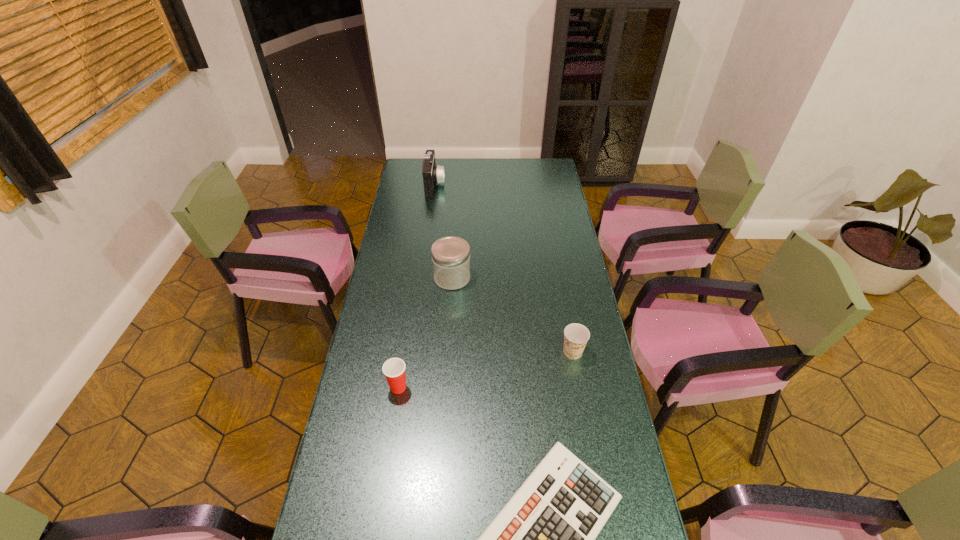
Where is `vacant space that satisfies the following two spatial constraints: 1. on the lens of the farther Dixie cup; 2. on the left side of the farthest object`? The width and height of the screenshot is (960, 540). vacant space that satisfies the following two spatial constraints: 1. on the lens of the farther Dixie cup; 2. on the left side of the farthest object is located at coordinates (412, 352).

Identify the location of vacant area in the image that satisfies the following two spatial constraints: 1. on the back side of the nearer Dixie cup; 2. on the right side of the right Dixie cup. (404, 352).